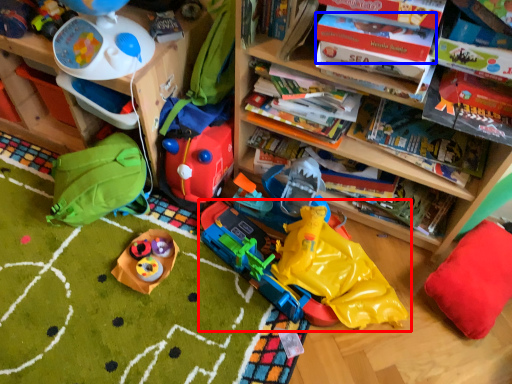
Question: Which point is closer to the camera, toy (highlighted by a red box) or book (highlighted by a blue box)?

Choices:
 (A) toy
 (B) book

Answer: (B)